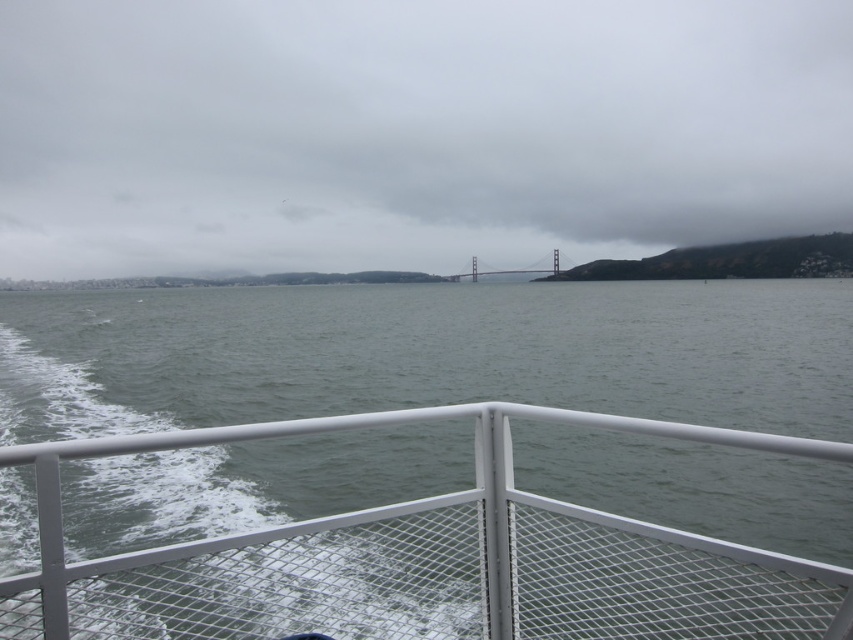
You are navigating a boat and need to pass through a narrow channel between two landmarks. You see the gray water at center and the painted steel bridge at center. Which one is wider to safely navigate through?

The gray water at center might be wider than painted steel bridge at center, so it would be safer to navigate through the gray water at center.

You are a sailor navigating a boat and want to know if there is enough space between the transparent water at center and the painted steel bridge at center to safely pass through. Can you determine if the distance is sufficient?

The transparent water at center and painted steel bridge at center are 219.58 feet apart. This distance is likely sufficient for safe passage as it exceeds typical navigational clearance requirements for most vessels, provided there are no other obstructions or currents affecting the route.

You are navigating a boat and need to avoid a submerged rock located at coordinates 0.830, 0.512. Is the gray water at center in a safe location to navigate around the rock?

The gray water at center is located exactly at the coordinates (x=436, y=531) where the submerged rock is, so it is not safe to navigate there.